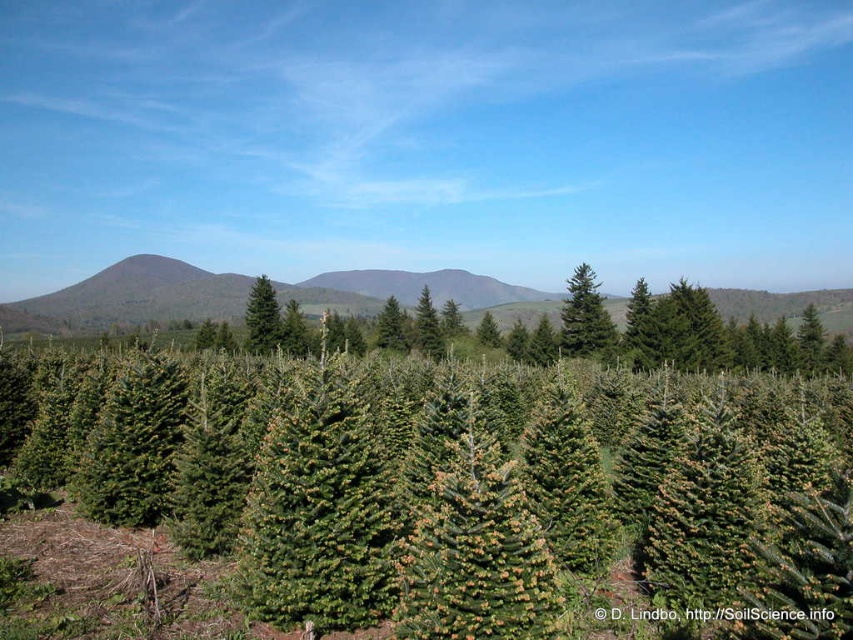
Is green matte forest at center taller than green needle-like tree at center?

Indeed, green matte forest at center has a greater height compared to green needle-like tree at center.

Is green matte forest at center below green needle-like tree at center?

No.

Is point (357, 280) positioned behind point (596, 310)?

Yes, point (357, 280) is behind point (596, 310).

At what (x,y) coordinates should I click in order to perform the action: click on green matte forest at center. Please return your answer as a coordinate pair (x, y). Looking at the image, I should click on (132, 298).

Does green matte forest at center lie in front of green matte evergreen tree at center?

That is False.

Who is higher up, green matte forest at center or green matte evergreen tree at center?

Positioned higher is green matte forest at center.

What do you see at coordinates (132, 298) in the screenshot?
I see `green matte forest at center` at bounding box center [132, 298].

At what (x,y) coordinates should I click in order to perform the action: click on green matte forest at center. Please return your answer as a coordinate pair (x, y). This screenshot has width=853, height=640. Looking at the image, I should click on (132, 298).

Is green needle-like tree at center to the left of green matte evergreen tree at center from the viewer's perspective?

No, green needle-like tree at center is not to the left of green matte evergreen tree at center.

Is point (608, 330) positioned before point (260, 294)?

That is True.

Is point (581, 296) farther from camera compared to point (260, 289)?

That is False.

At what (x,y) coordinates should I click in order to perform the action: click on green needle-like tree at center. Please return your answer as a coordinate pair (x, y). Image resolution: width=853 pixels, height=640 pixels. Looking at the image, I should click on (584, 316).